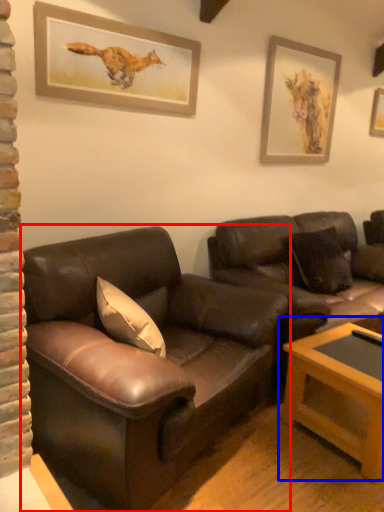
Question: Among these objects, which one is farthest to the camera, studio couch (highlighted by a red box) or table (highlighted by a blue box)?

Choices:
 (A) studio couch
 (B) table

Answer: (B)